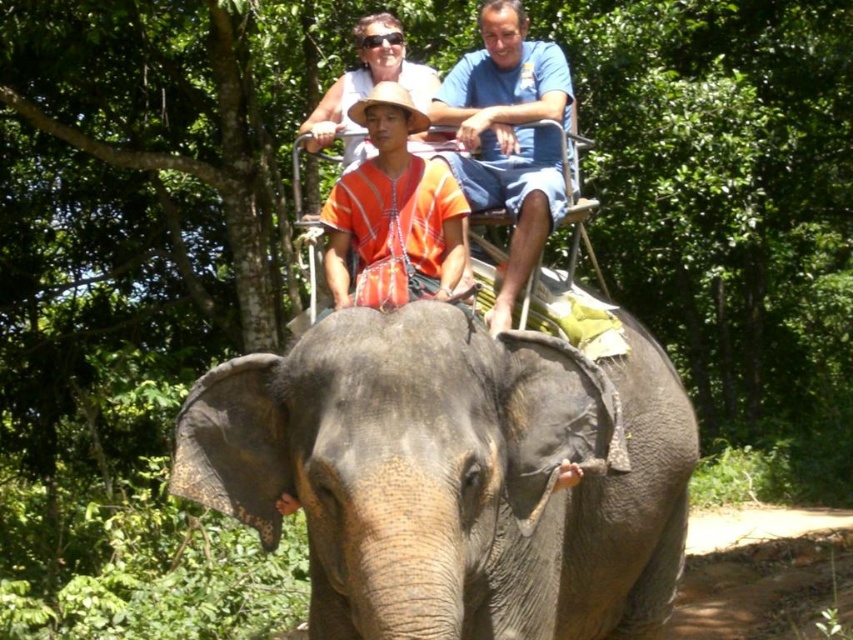
This screenshot has height=640, width=853. Describe the element at coordinates (454, 474) in the screenshot. I see `gray textured elephant at center` at that location.

Which is in front, point (570, 365) or point (531, 253)?

Point (570, 365)

Identify the location of gray textured elephant at center. This screenshot has width=853, height=640. (454, 474).